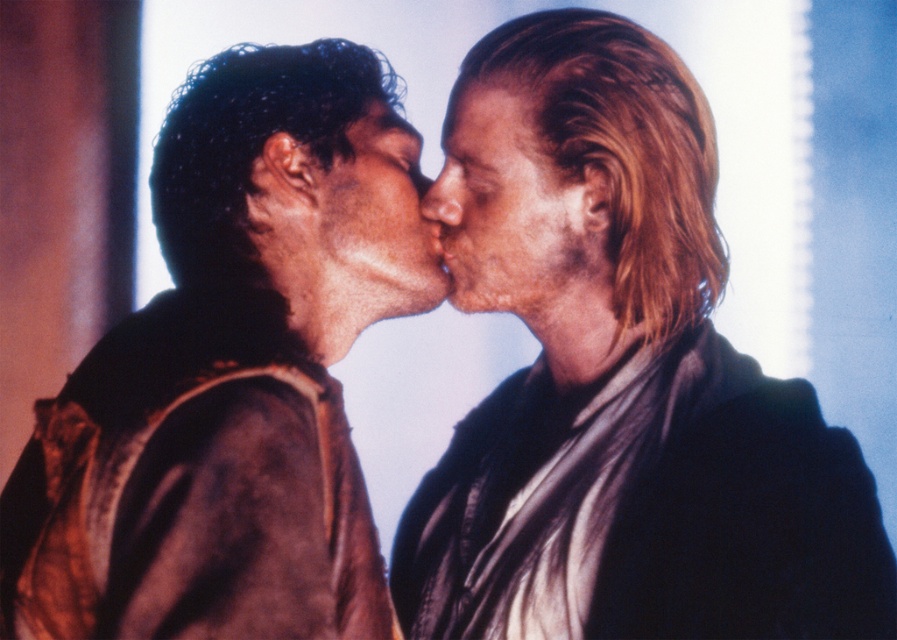
Question: Can you confirm if smooth skin face at center is thinner than dry skin at center?

Choices:
 (A) no
 (B) yes

Answer: (A)

Question: Which object is farther from the camera taking this photo?

Choices:
 (A) brown suede jacket at left
 (B) shiny black jacket at right

Answer: (B)

Question: Does brown suede jacket at left appear under smooth skin nose at center?

Choices:
 (A) yes
 (B) no

Answer: (A)

Question: Does matte brown face at center appear on the left side of dry skin at center?

Choices:
 (A) yes
 (B) no

Answer: (A)

Question: Based on their relative distances, which object is farther from the matte brown face at center?

Choices:
 (A) shiny black jacket at right
 (B) smooth skin nose at center

Answer: (A)

Question: Which point appears farthest from the camera in this image?

Choices:
 (A) (451, 212)
 (B) (875, 532)
 (C) (473, 240)
 (D) (199, 227)

Answer: (A)